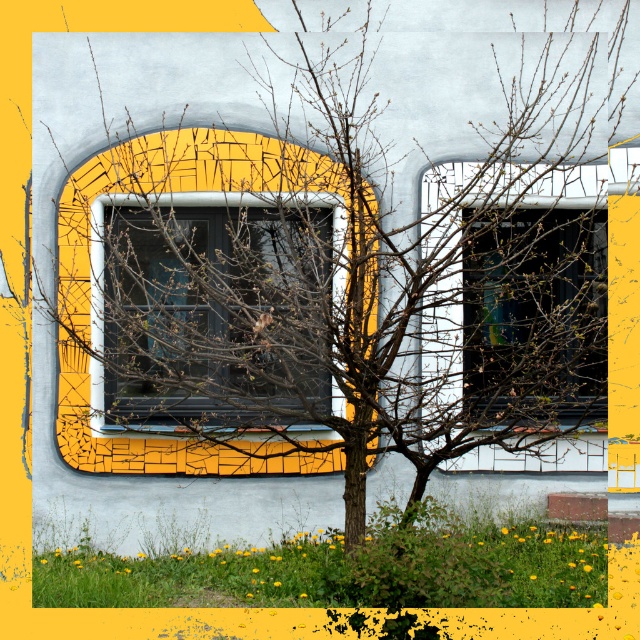
Question: Among these objects, which one is farthest from the camera?

Choices:
 (A) matte glass window at center
 (B) transparent glass window at center

Answer: (B)

Question: Among these objects, which one is farthest from the camera?

Choices:
 (A) transparent glass window at center
 (B) matte glass window at center

Answer: (A)

Question: Is matte glass window at center below transparent glass window at center?

Choices:
 (A) yes
 (B) no

Answer: (B)

Question: Can you confirm if matte glass window at center is thinner than transparent glass window at center?

Choices:
 (A) yes
 (B) no

Answer: (B)

Question: Considering the relative positions of matte glass window at center and transparent glass window at center in the image provided, where is matte glass window at center located with respect to transparent glass window at center?

Choices:
 (A) below
 (B) above

Answer: (B)